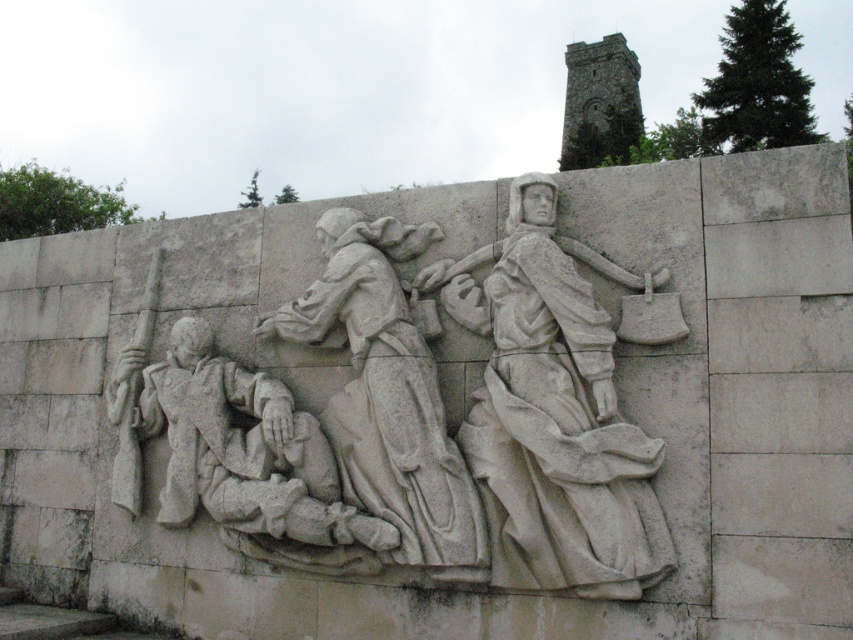
What is located at the coordinates point [553,412]?

The white stone figure at center is located at point [553,412].

You are an art conservator examining the white stone relief at center and the gray stone figure at center. Which object is positioned closer to your viewpoint?

The white stone relief at center is closer to the viewer than the gray stone figure at center.